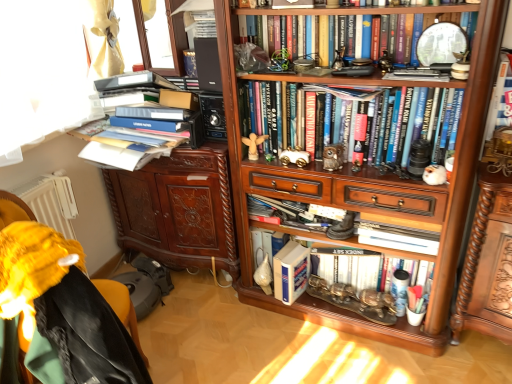
Question: Would you say black matte speaker at upper center is inside or outside hardcover book at upper right, which appears as the 2th book when viewed from the top?

Choices:
 (A) inside
 (B) outside

Answer: (B)

Question: Is black matte speaker at upper center to the left or to the right of hardcover book at upper right, which is counted as the fourth book, starting from the bottom, in the image?

Choices:
 (A) left
 (B) right

Answer: (A)

Question: Which of these objects is positioned farthest from the black matte speaker at upper center?

Choices:
 (A) matte white shell at center, marked as the 3th toy in a right-to-left arrangement
 (B) hardcover book at upper center, which is the fifth book in bottom-to-top order
 (C) metallic silver car at center, arranged as the 3th toy when viewed from the top
 (D) gold metallic car at center, which is the 2th toy from right to left
 (E) brown carved cabinet at left

Answer: (A)

Question: Estimate the real-world distances between objects in this image. Which object is farther from the transparent glass window at upper left?

Choices:
 (A) black matte speaker at upper center
 (B) hardcover book at upper right, which is counted as the fourth book, starting from the bottom
 (C) wooden carved shelf at lower right
 (D) brown carved cabinet at left
 (E) wooden angel at center, which is the 1th toy from top to bottom

Answer: (C)